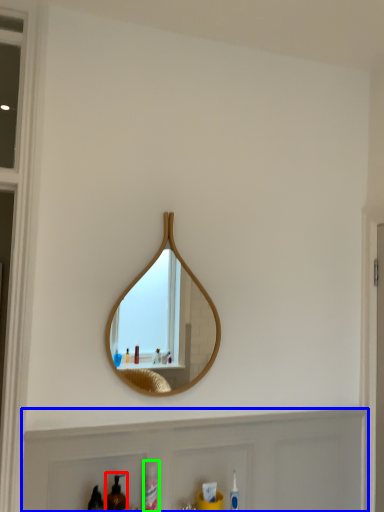
Question: Which object is the closest to the mouthwash (highlighted by a red box)? Choose among these: cabinet (highlighted by a blue box) or cleaning product (highlighted by a green box).

Choices:
 (A) cabinet
 (B) cleaning product

Answer: (B)